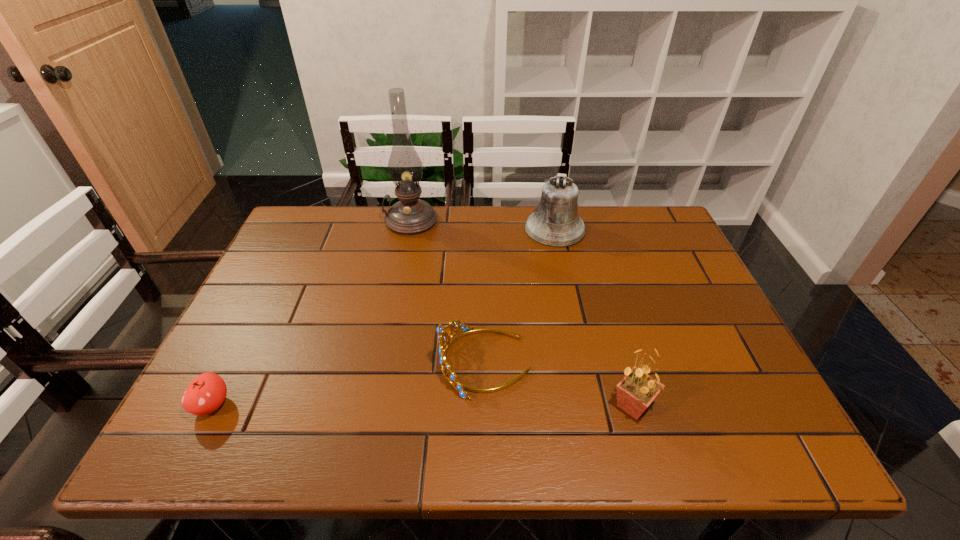
Locate an element on the screen. oil lamp is located at coordinates (410, 215).

The width and height of the screenshot is (960, 540). I want to click on the tallest object, so click(410, 215).

Locate an element on the screen. Image resolution: width=960 pixels, height=540 pixels. bell is located at coordinates (555, 223).

You are a GUI agent. You are given a task and a screenshot of the screen. Output one action in this format:
    pyautogui.click(x=<x>, y=<y>)
    Task: Click on the sunflower
    
    Given the screenshot: What is the action you would take?
    pyautogui.click(x=635, y=392)

What are the coordinates of `tiara` in the screenshot? It's located at (445, 340).

At what (x,y) coordinates should I click in order to perform the action: click on the fourth tallest object. Please return your answer as a coordinate pair (x, y). This screenshot has width=960, height=540. Looking at the image, I should click on (445, 340).

This screenshot has width=960, height=540. I want to click on the leftmost object, so point(206,393).

I want to click on apple, so click(206, 393).

This screenshot has width=960, height=540. What are the coordinates of `free space located 0.130m on the right of the oil lamp` in the screenshot? It's located at [479, 221].

Locate an element on the screen. free space located on the front of the bell is located at coordinates (570, 298).